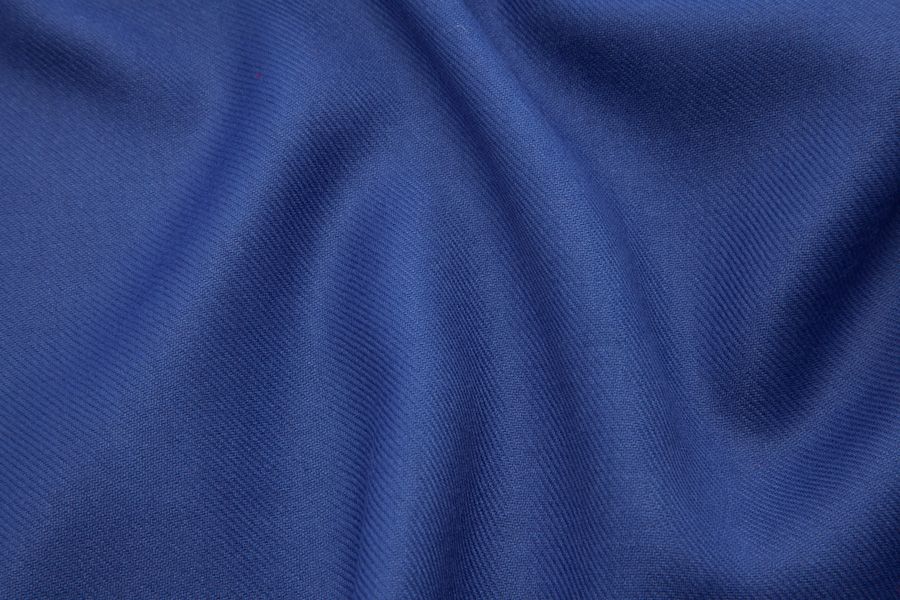
Find the location of a particular element. This screenshot has height=600, width=900. inside corner on the upper left hand side is located at coordinates (11, 12).